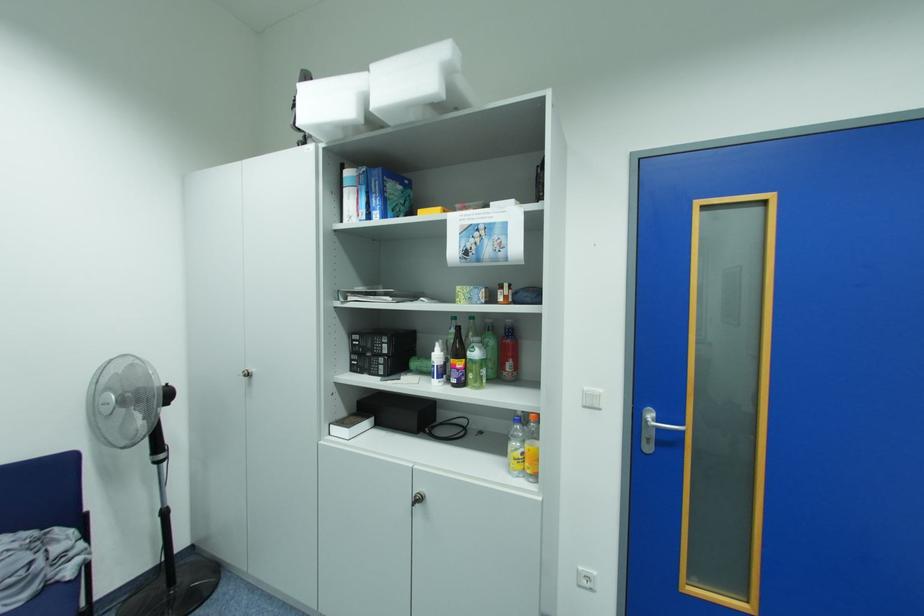
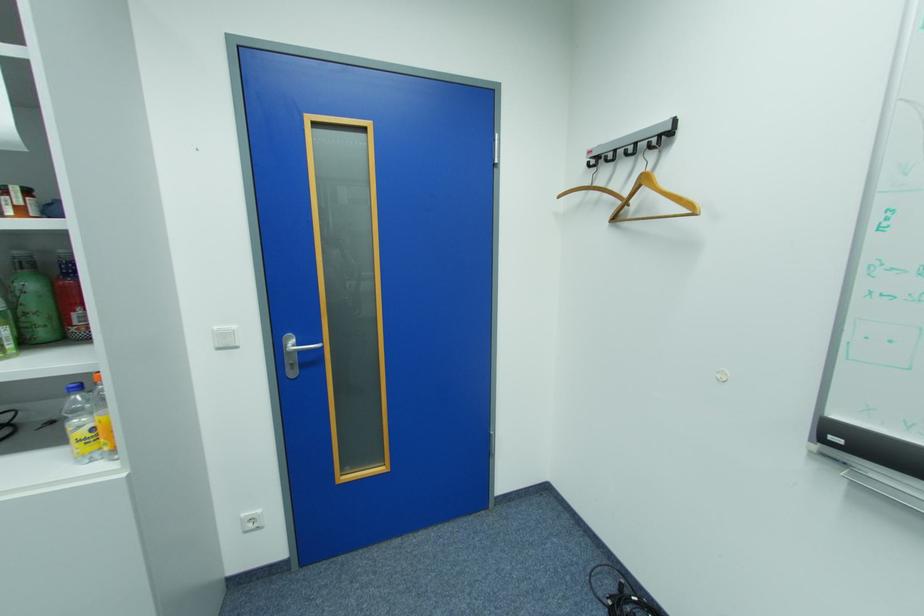
Locate, in the second image, the point that corresponds to (x=589, y=569) in the first image.

(252, 516)